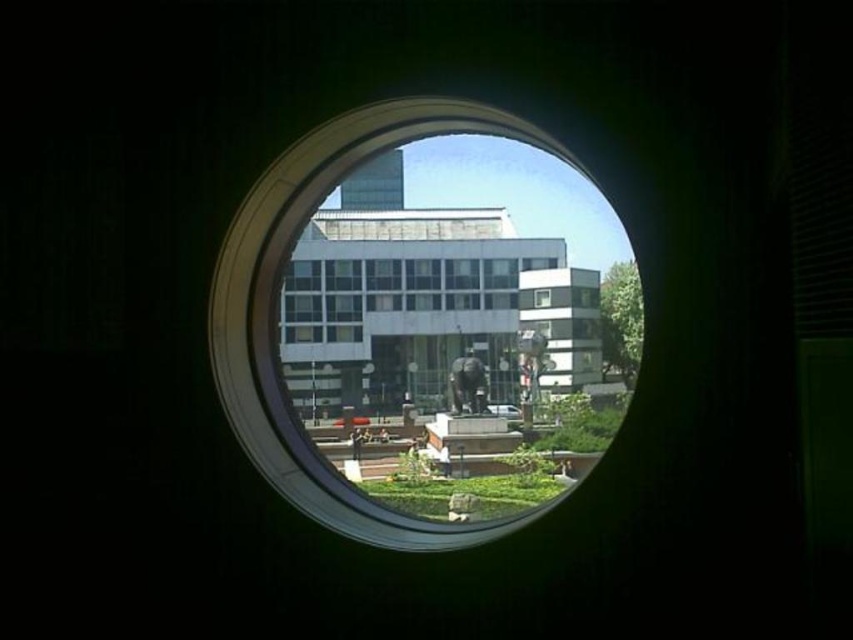
You are an architect analyzing the spatial relationship between the transparent glass porthole at center and the white glass building at center in the image. Which object is located lower in the scene?

The transparent glass porthole at center is positioned under the white glass building at center, so it is located lower in the scene.

You are an architect reviewing blueprints and notice the transparent glass porthole at center and the white glass building at center in the design. Based on the spatial relationship between them, which object would appear closer to the viewer in the final structure?

The transparent glass porthole at center would appear closer to the viewer because it is shorter than the white glass building at center, making it positioned in front in the visual hierarchy.

You are an architect designing a new building and want to ensure the statue in front of the white glass building at center is visible through the transparent glass porthole at center. Given the size difference between the two, will the statue be fully visible through the porthole?

The transparent glass porthole at center is larger than the white glass building at center. Since the statue is in front of the building, it would likely be fully visible through the porthole as the porthole is bigger and the statue is closer, occupying less space in the frame.